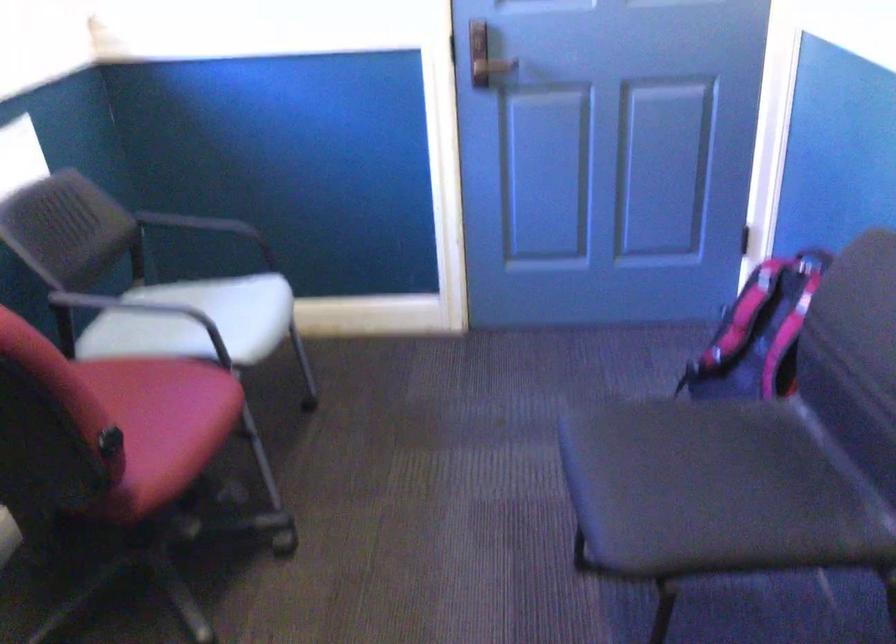
Where would you sit the black chair sitting surface? Please return your answer as a coordinate pair (x, y).

(698, 485)